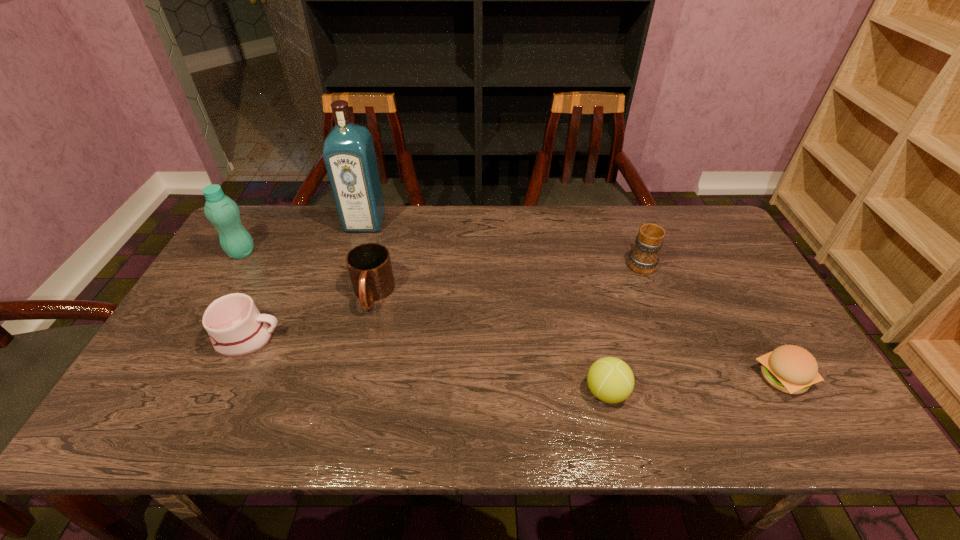
The width and height of the screenshot is (960, 540). What are the coordinates of `object that is the closest one to the second mug from left to right` in the screenshot? It's located at (x=236, y=328).

Locate an element on the screen. The image size is (960, 540). the closest mug relative to the rightmost mug is located at coordinates (369, 265).

Select which mug appears as the second closest to the second tallest object. Please provide its 2D coordinates. Your answer should be formatted as a tuple, i.e. [(x, y)], where the tuple contains the x and y coordinates of a point satisfying the conditions above.

[(369, 265)]

Locate an element on the screen. vacant area in the image that satisfies the following two spatial constraints: 1. on the flat label side of the liquor; 2. on the side with the handle of the nearest mug is located at coordinates (329, 338).

Image resolution: width=960 pixels, height=540 pixels. In order to click on free space that satisfies the following two spatial constraints: 1. on the flat label side of the rightmost object; 2. on the left side of the farthest object in this screenshot , I will do `click(317, 377)`.

Identify the location of free region that satisfies the following two spatial constraints: 1. on the side of the second mug from left to right with the handle; 2. on the left side of the fifth object from left to right. The image size is (960, 540). (349, 392).